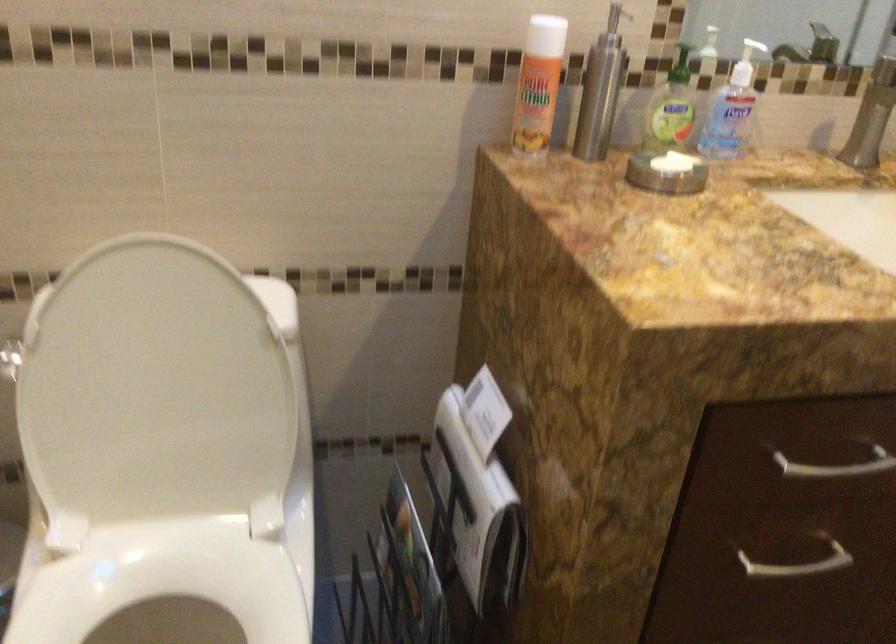
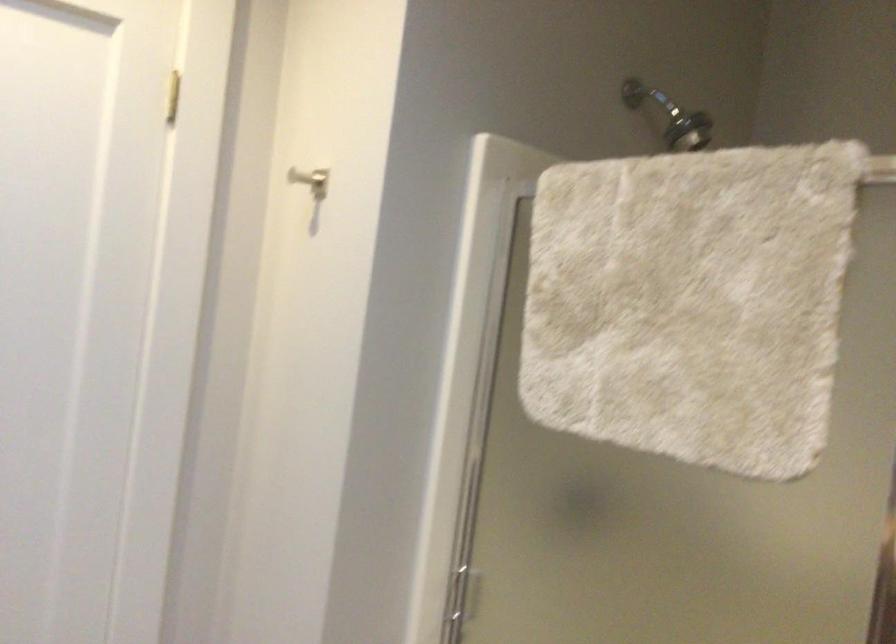
Based on the continuous images, in which direction is the camera rotating?

The camera's rotation is toward right-down.